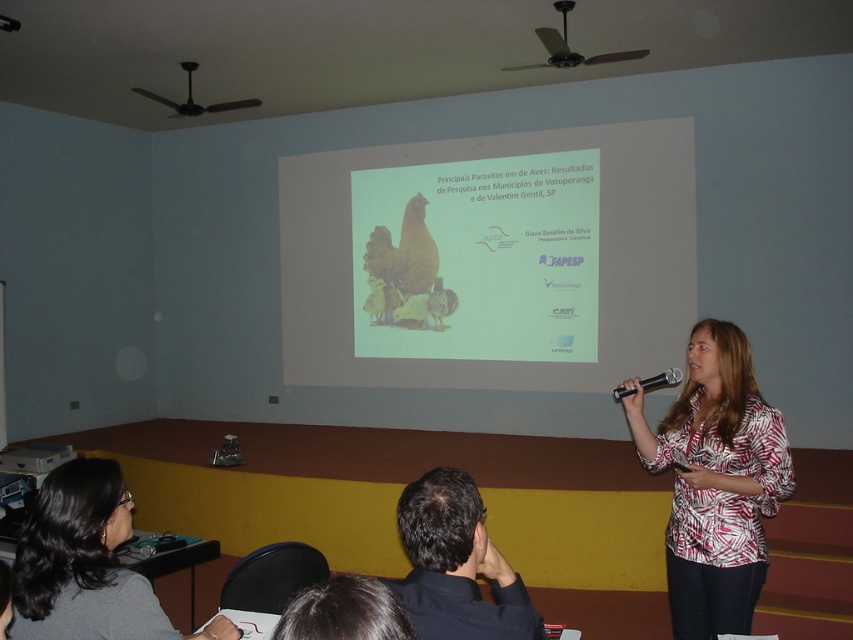
Who is lower down, dark brown hair at lower left or black plastic microphone at center?

dark brown hair at lower left is lower down.

Which is behind, point (88, 604) or point (653, 380)?

Point (653, 380)

Locate an element on the screen. dark brown hair at lower left is located at coordinates (86, 564).

Measure the distance between point [483,182] and camera.

Point [483,182] and camera are 22.18 feet apart.

Does matte white screen at center appear on the left side of dark hair at upper center?

In fact, matte white screen at center is to the right of dark hair at upper center.

Between point (398, 272) and point (474, 532), which one is positioned behind?

The point (398, 272) is behind.

Image resolution: width=853 pixels, height=640 pixels. In order to click on matte white screen at center in this screenshot , I will do `click(490, 259)`.

Who is lower down, dark hair at upper center or black plastic projector at upper center?

Positioned lower is dark hair at upper center.

Which is in front, point (456, 605) or point (569, 58)?

Point (456, 605) is in front.

Where is `dark hair at upper center`? The width and height of the screenshot is (853, 640). dark hair at upper center is located at coordinates (456, 564).